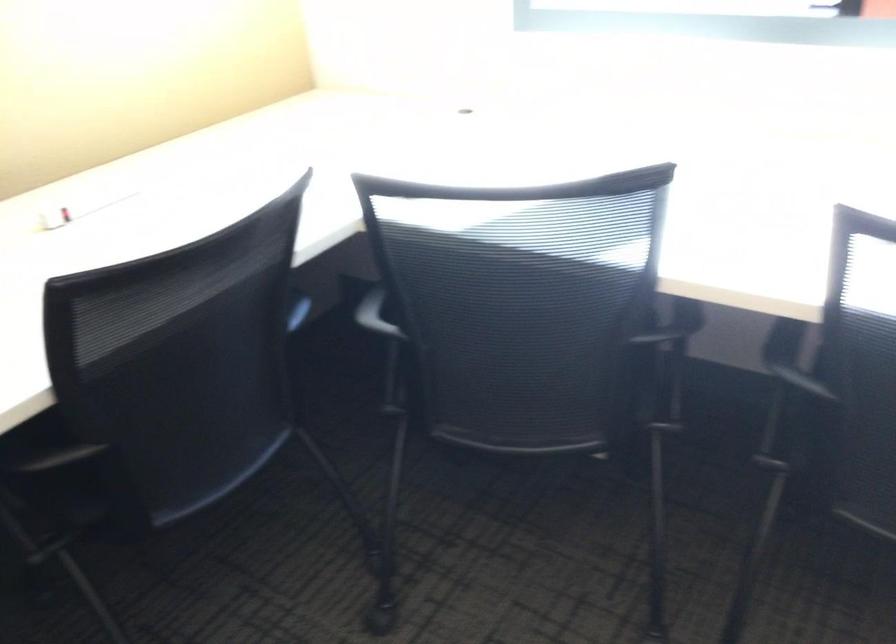
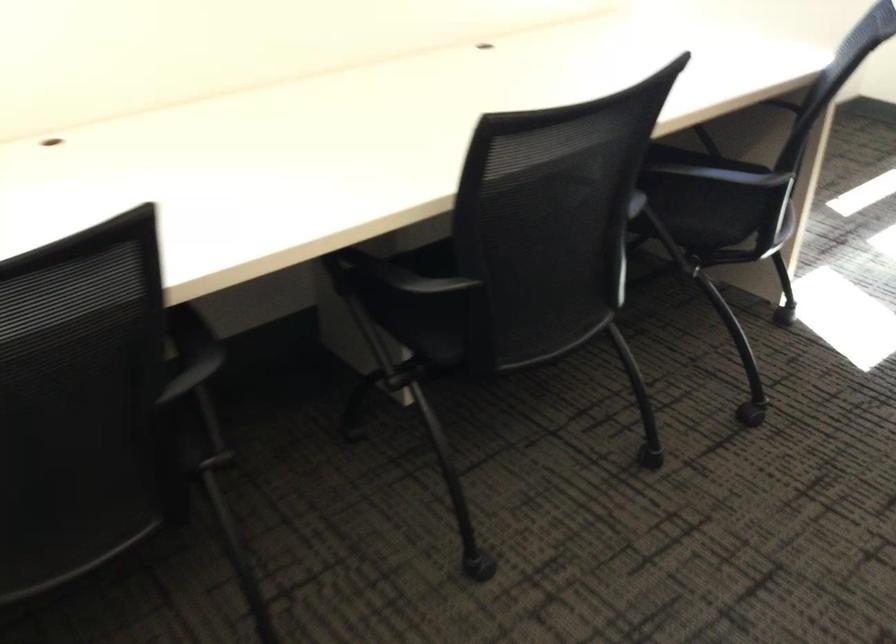
Based on the continuous images, in which direction is the camera rotating?

The camera rotated toward right-down.